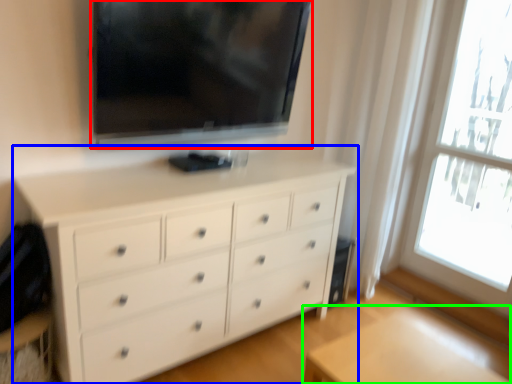
Question: Which is farther away from television (highlighted by a red box)? chest of drawers (highlighted by a blue box) or table (highlighted by a green box)?

Choices:
 (A) chest of drawers
 (B) table

Answer: (B)